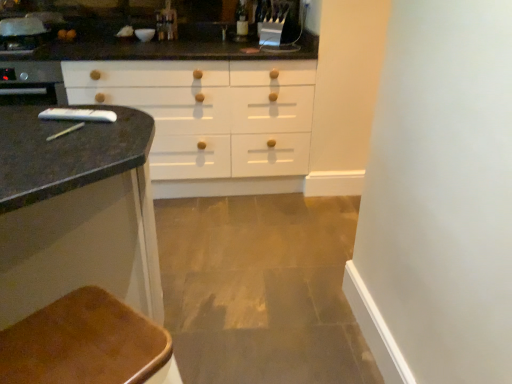
Where is `blank space above brown leather chair at lower left (from a real-world perspective)`? blank space above brown leather chair at lower left (from a real-world perspective) is located at coordinates (87, 338).